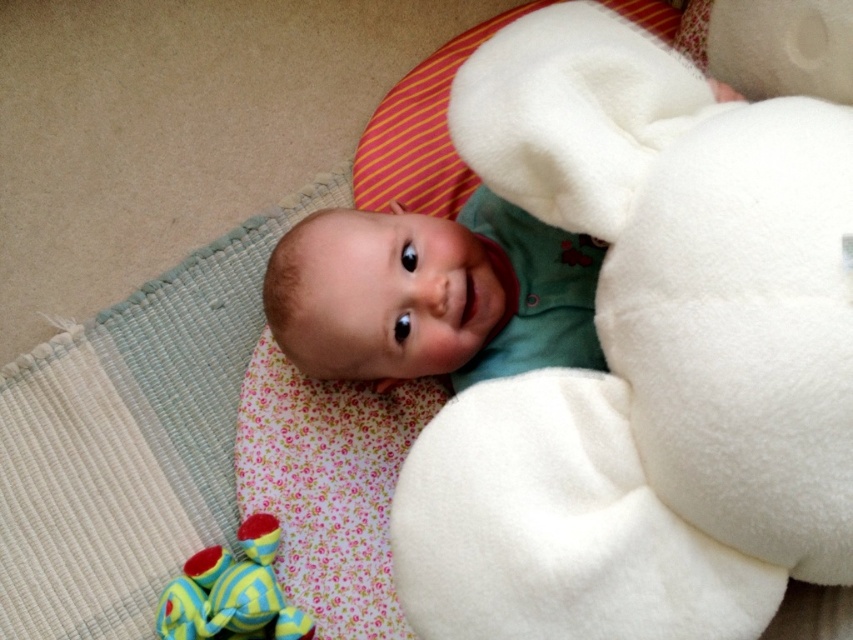
Question: Which object is closer to the camera taking this photo?

Choices:
 (A) green fleece baby at center
 (B) striped rubber toy at lower left

Answer: (A)

Question: Is green fleece baby at center to the right of striped rubber toy at lower left from the viewer's perspective?

Choices:
 (A) no
 (B) yes

Answer: (B)

Question: Is green fleece baby at center further to camera compared to striped rubber toy at lower left?

Choices:
 (A) yes
 (B) no

Answer: (B)

Question: From the image, what is the correct spatial relationship of green fleece baby at center in relation to striped rubber toy at lower left?

Choices:
 (A) left
 (B) right

Answer: (B)

Question: Which object appears closest to the camera in this image?

Choices:
 (A) striped rubber toy at lower left
 (B) green fleece baby at center

Answer: (B)

Question: Among these objects, which one is farthest from the camera?

Choices:
 (A) striped rubber toy at lower left
 (B) green fleece baby at center

Answer: (A)